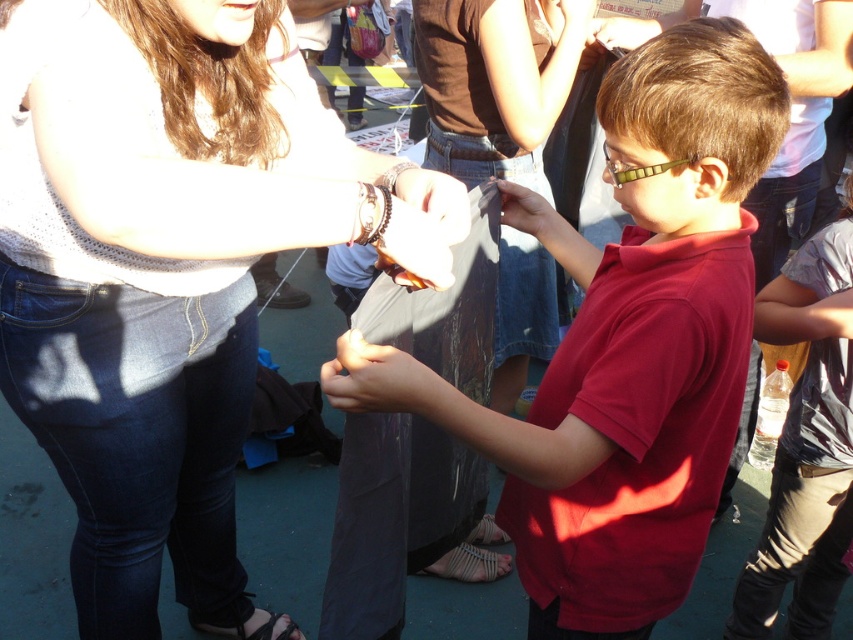
You are a photographer standing at the edge of the scene. You need to capture a closeup shot of both the matte black shirt at center and the matte black phone at center in the same frame. What is the minimum distance you should maintain from the shirt to ensure both are in focus?

The minimum distance you should maintain from the matte black shirt at center is 12.97 inches to ensure both the matte black shirt at center and the matte black phone at center are in focus since they are 12.97 inches apart.

You are standing at the position of the viewer in the scene. The boy is wearing a red polo shirt. There is also a matte black shirt at center. Which shirt is closer to you?

The matte black shirt at center is closer to you since it is only 1.08 meters away from the viewer.

Consider the image. You are a photographer trying to capture a candid shot of the matte black shirt at center and the white fabric sandal at lower center. Since you want to ensure both are visible in the frame, which object should you focus on first to account for their size difference?

The matte black shirt at center is taller than the white fabric sandal at lower center, so you should focus on the matte black shirt at center first to ensure its full height is captured before adjusting the frame for the smaller sandal.